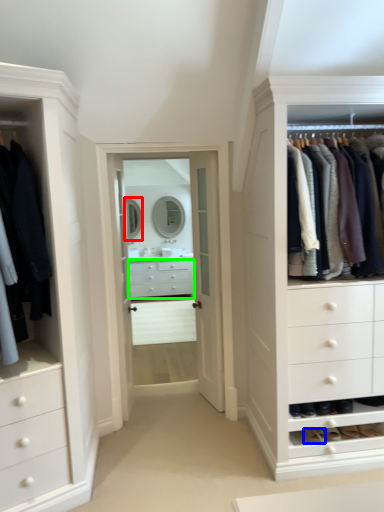
Question: Which object is the closest to the mirror (highlighted by a red box)? Choose among these: shoe (highlighted by a blue box) or drawer (highlighted by a green box).

Choices:
 (A) shoe
 (B) drawer

Answer: (B)